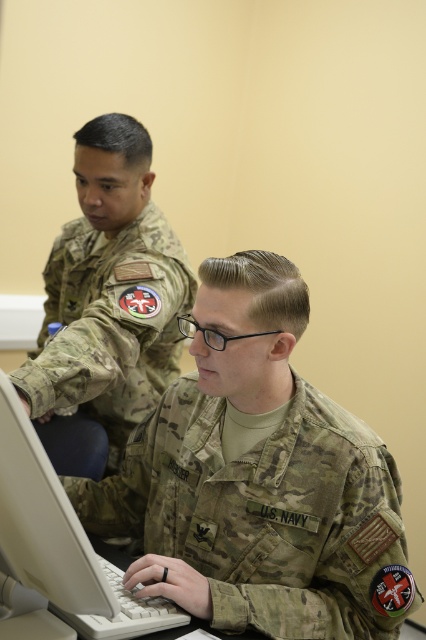
Which is more to the left, camouflage uniform at center or white plastic laptop at lower left?

camouflage uniform at center

Where is `camouflage uniform at center`? The image size is (426, 640). camouflage uniform at center is located at coordinates (106, 305).

Who is more distant from viewer, (293,481) or (60,493)?

The point (293,481) is more distant.

Is camouflage fabric us navy uniform at center thinner than white plastic laptop at lower left?

No, camouflage fabric us navy uniform at center is not thinner than white plastic laptop at lower left.

Is point (316, 618) positioned in front of point (11, 490)?

No.

Where is `camouflage fabric us navy uniform at center`? camouflage fabric us navy uniform at center is located at coordinates (265, 515).

Who is more distant from viewer, (238, 609) or (36, 387)?

The point (36, 387) is behind.

This screenshot has width=426, height=640. What are the coordinates of `camouflage fabric us navy uniform at center` in the screenshot? It's located at (265, 515).

The height and width of the screenshot is (640, 426). What are the coordinates of `camouflage fabric us navy uniform at center` in the screenshot? It's located at (265, 515).